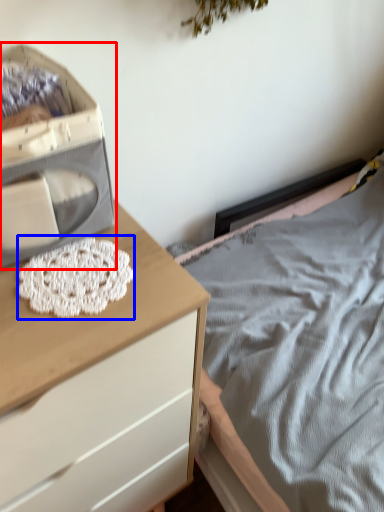
Question: Which object appears farthest to the camera in this image, storage box (highlighted by a red box) or lace (highlighted by a blue box)?

Choices:
 (A) storage box
 (B) lace

Answer: (B)